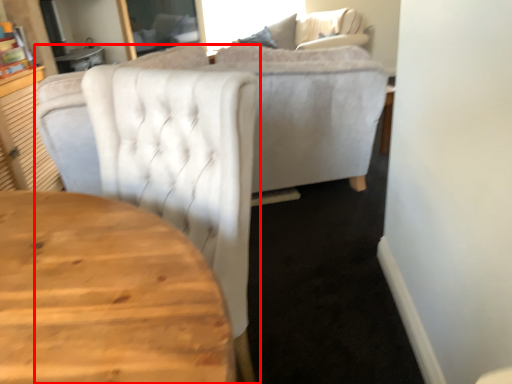
Question: From the image, what is the correct spatial relationship of chair (annotated by the red box) in relation to couch?

Choices:
 (A) left
 (B) right

Answer: (A)